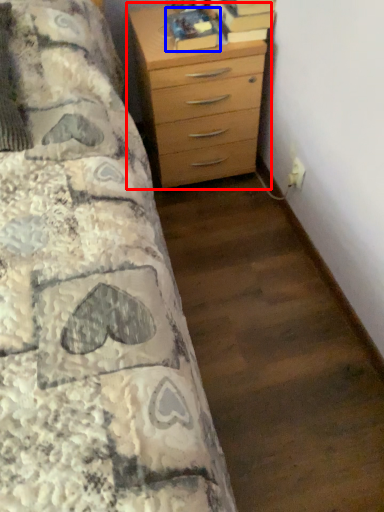
Question: Among these objects, which one is farthest to the camera, chest of drawers (highlighted by a red box) or book (highlighted by a blue box)?

Choices:
 (A) chest of drawers
 (B) book

Answer: (B)